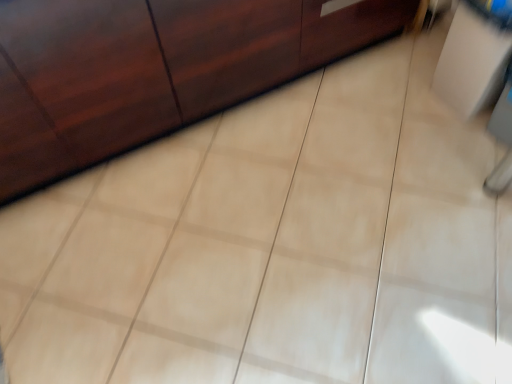
Question: Considering the positions of matte wood cabinet at upper left and white glossy cabinet at upper right in the image, is matte wood cabinet at upper left taller or shorter than white glossy cabinet at upper right?

Choices:
 (A) tall
 (B) short

Answer: (A)

Question: In the image, is matte wood cabinet at upper left on the left side or the right side of white glossy cabinet at upper right?

Choices:
 (A) right
 (B) left

Answer: (B)

Question: Looking at the image, does matte wood cabinet at upper left seem bigger or smaller compared to white glossy cabinet at upper right?

Choices:
 (A) small
 (B) big

Answer: (B)

Question: Is point coord(435,77) positioned closer to the camera than point coord(128,61)?

Choices:
 (A) closer
 (B) farther

Answer: (B)

Question: Is white glossy cabinet at upper right taller or shorter than matte wood cabinet at upper left?

Choices:
 (A) tall
 (B) short

Answer: (B)

Question: Looking at the image, does white glossy cabinet at upper right seem bigger or smaller compared to matte wood cabinet at upper left?

Choices:
 (A) big
 (B) small

Answer: (B)

Question: Considering the positions of white glossy cabinet at upper right and matte wood cabinet at upper left in the image, is white glossy cabinet at upper right wider or thinner than matte wood cabinet at upper left?

Choices:
 (A) wide
 (B) thin

Answer: (B)